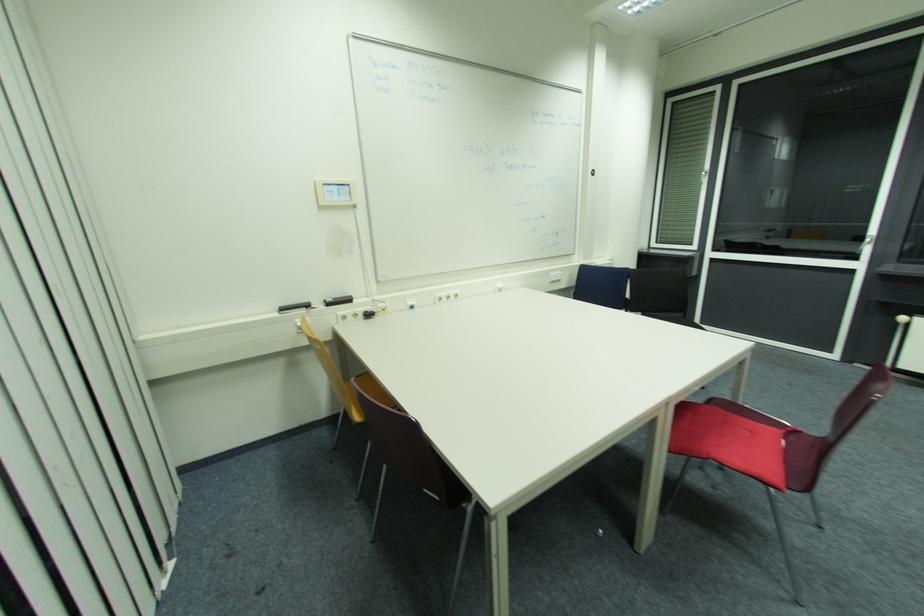
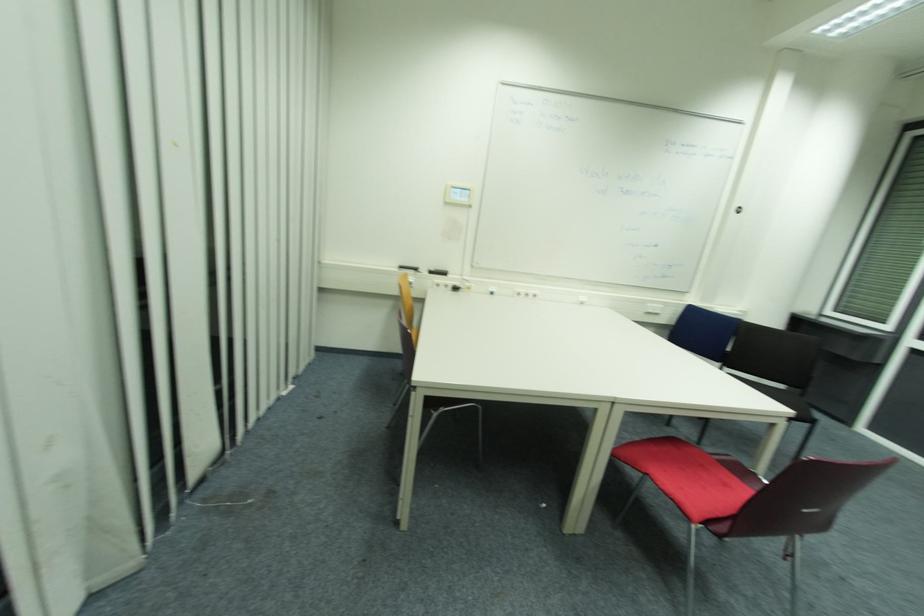
In the second image, find the point that corresponds to [333,305] in the first image.

(433, 273)